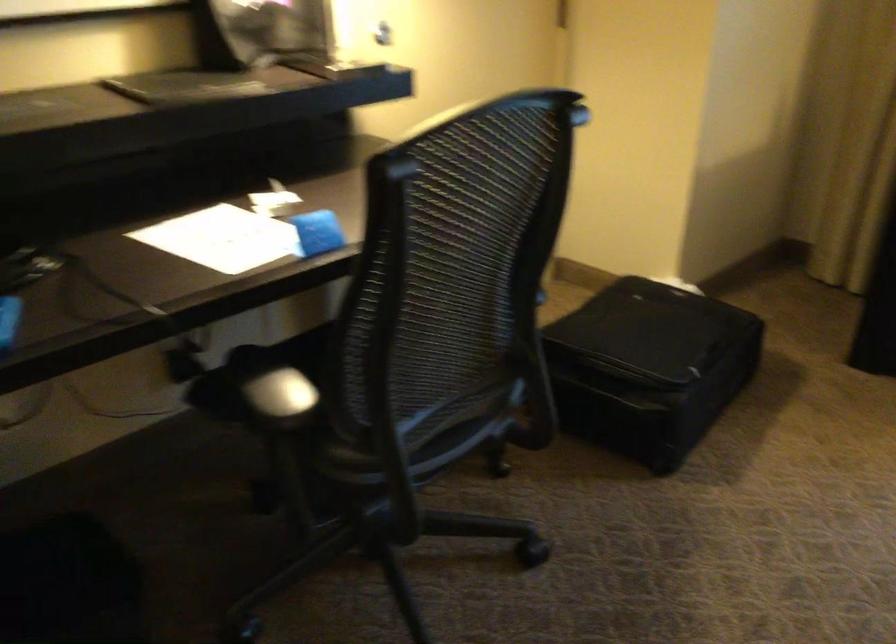
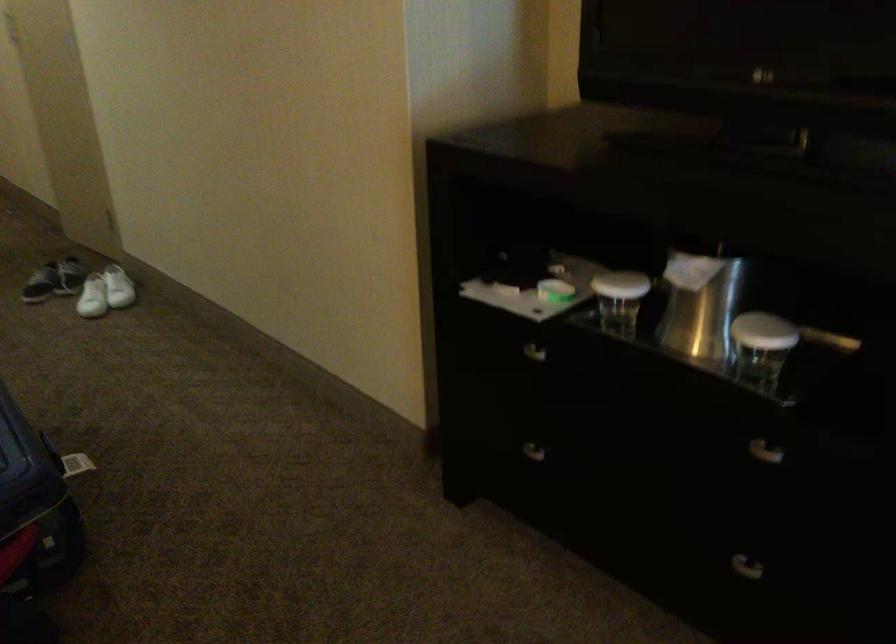
The images are taken continuously from a first-person perspective. In which direction is your viewpoint rotating?

The camera's rotation is toward left-down.